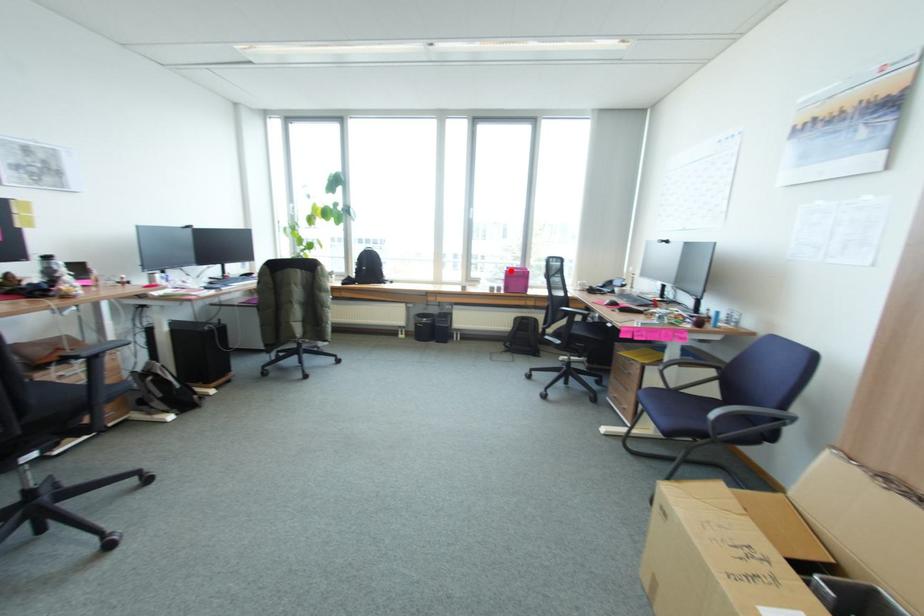
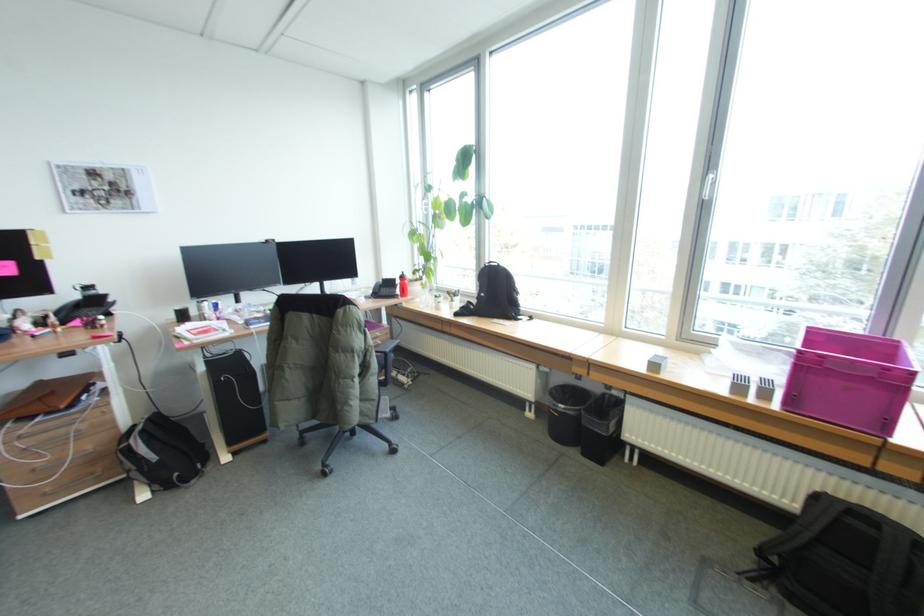
Question: I am providing you with two images of the same scene from different viewpoints. A red point is shown in image1. For the corresponding object point in image2, is it positioned nearer or farther from the camera?

Choices:
 (A) Nearer
 (B) Farther

Answer: (B)